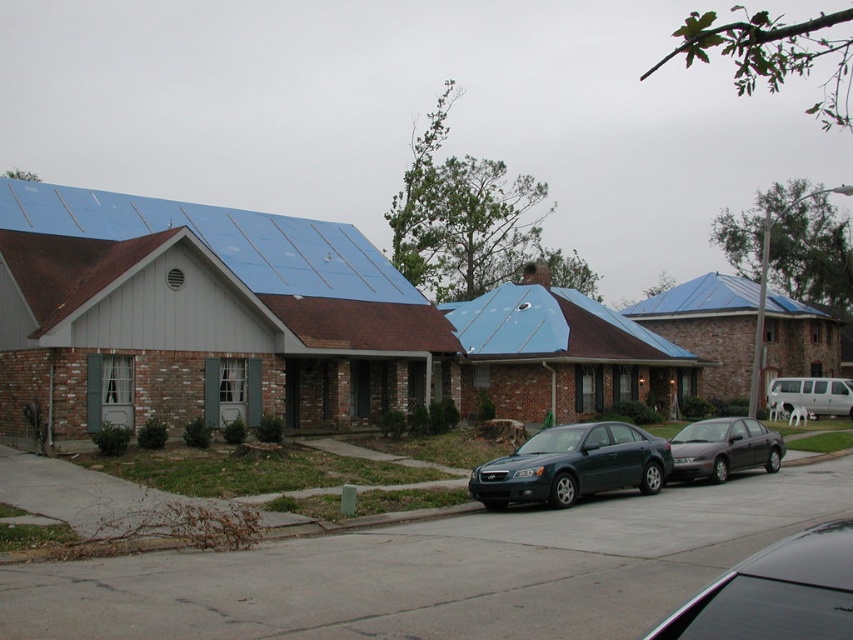
You are a delivery driver approaching the residential street. You need to park your vehicle, which is the same size as the matte black sedan at center, in a spot that is under the blue metallic roof at upper center. Is this possible based on the scene?

The matte black sedan at center is below the blue metallic roof at upper center, so yes, you can park your vehicle under the blue metallic roof at upper center since it is positioned directly beneath it.